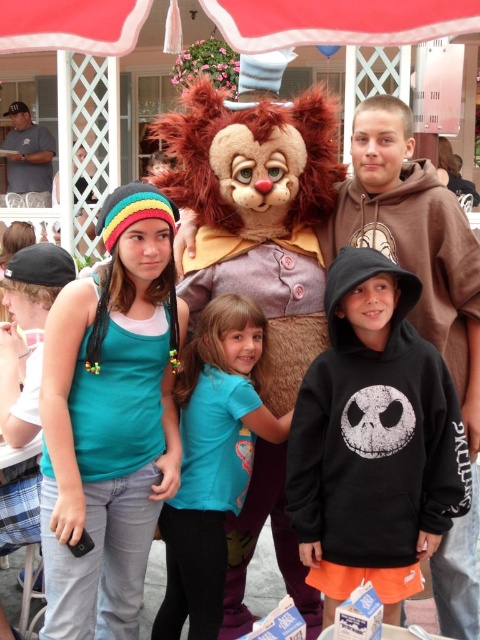
Does teal fabric tank top at left have a greater height compared to red fabric canopy at upper center?

Yes, teal fabric tank top at left is taller than red fabric canopy at upper center.

What are the coordinates of `teal fabric tank top at left` in the screenshot? It's located at (108, 481).

Between black cotton hoodie at center and red fabric canopy at upper center, which one is positioned lower?

black cotton hoodie at center

Locate an element on the screen. Image resolution: width=480 pixels, height=640 pixels. black cotton hoodie at center is located at coordinates (373, 433).

The image size is (480, 640). Find the location of `teal t-shirt at center`. teal t-shirt at center is located at coordinates (212, 461).

Which of these two, teal t-shirt at center or red fabric canopy at upper center, stands shorter?

red fabric canopy at upper center is shorter.

Is point (201, 609) farther from camera compared to point (44, 35)?

Yes, point (201, 609) is farther from viewer.

Locate an element on the screen. This screenshot has height=640, width=480. teal t-shirt at center is located at coordinates (212, 461).